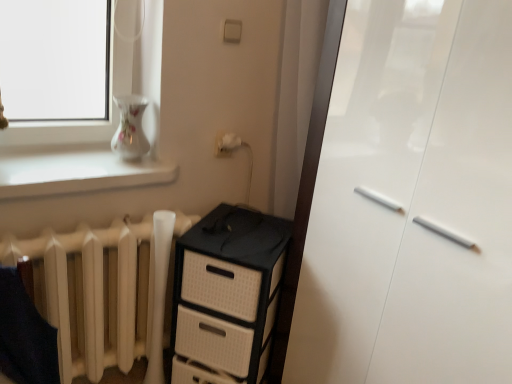
Question: Can you confirm if white glossy vase at upper left is smaller than white matte radiator at lower left?

Choices:
 (A) no
 (B) yes

Answer: (B)

Question: From the image's perspective, is white glossy vase at upper left beneath white matte radiator at lower left?

Choices:
 (A) yes
 (B) no

Answer: (B)

Question: From a real-world perspective, is white glossy vase at upper left positioned over white matte radiator at lower left based on gravity?

Choices:
 (A) yes
 (B) no

Answer: (A)

Question: Is white glossy vase at upper left wider than white matte radiator at lower left?

Choices:
 (A) no
 (B) yes

Answer: (B)

Question: From a real-world perspective, is white glossy vase at upper left physically below white matte radiator at lower left?

Choices:
 (A) no
 (B) yes

Answer: (A)

Question: Can you confirm if white glossy vase at upper left is thinner than white matte radiator at lower left?

Choices:
 (A) no
 (B) yes

Answer: (A)

Question: Is white glossy vase at upper left positioned with its back to white glossy cabinet at right?

Choices:
 (A) no
 (B) yes

Answer: (A)

Question: Is white glossy vase at upper left next to white glossy cabinet at right and touching it?

Choices:
 (A) yes
 (B) no

Answer: (B)

Question: Does white glossy vase at upper left have a greater height compared to white glossy cabinet at right?

Choices:
 (A) no
 (B) yes

Answer: (A)

Question: Considering the relative sizes of white glossy vase at upper left and white glossy cabinet at right in the image provided, is white glossy vase at upper left thinner than white glossy cabinet at right?

Choices:
 (A) no
 (B) yes

Answer: (B)

Question: Can you confirm if white glossy vase at upper left is bigger than white glossy cabinet at right?

Choices:
 (A) no
 (B) yes

Answer: (A)

Question: Does white glossy vase at upper left appear on the left side of white glossy cabinet at right?

Choices:
 (A) no
 (B) yes

Answer: (B)

Question: From the image's perspective, is black plastic chest of drawers at center beneath white matte radiator at lower left?

Choices:
 (A) yes
 (B) no

Answer: (A)